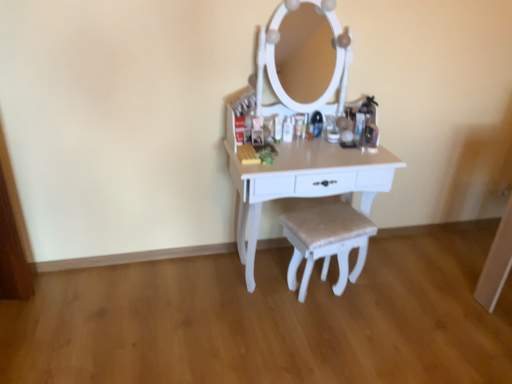
Question: From the image's perspective, is white painted wood table at center positioned above or below beige fabric stool at center?

Choices:
 (A) above
 (B) below

Answer: (A)

Question: Is white painted wood table at center inside the boundaries of beige fabric stool at center, or outside?

Choices:
 (A) outside
 (B) inside

Answer: (A)

Question: Considering the positions of white painted wood table at center and beige fabric stool at center in the image, is white painted wood table at center bigger or smaller than beige fabric stool at center?

Choices:
 (A) big
 (B) small

Answer: (A)

Question: Looking at their shapes, would you say beige fabric stool at center is wider or thinner than white painted wood table at center?

Choices:
 (A) wide
 (B) thin

Answer: (B)

Question: From the image's perspective, is beige fabric stool at center above or below white painted wood table at center?

Choices:
 (A) above
 (B) below

Answer: (B)

Question: Is beige fabric stool at center in front of or behind white painted wood table at center in the image?

Choices:
 (A) front
 (B) behind

Answer: (B)

Question: From a real-world perspective, relative to white painted wood table at center, is beige fabric stool at center vertically above or below?

Choices:
 (A) above
 (B) below

Answer: (B)